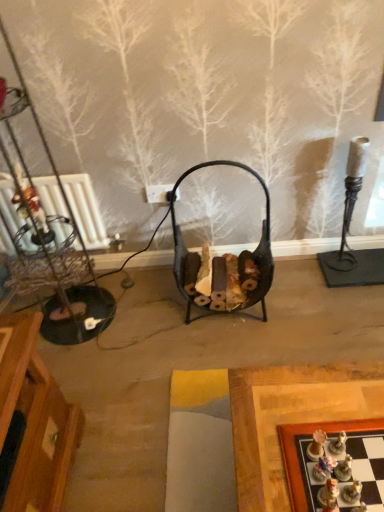
Identify the location of free location in front of black metal basket at center. (228, 353).